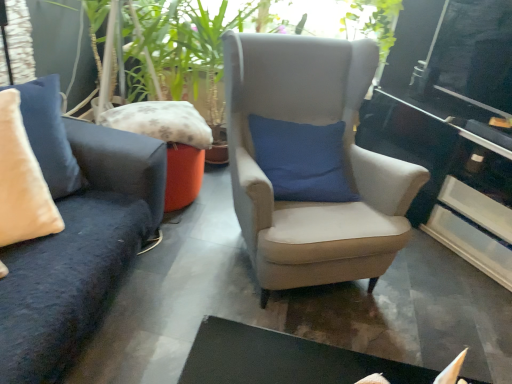
Question: Is fluffy fabric pillow at center, placed as the second pillow when sorted from front to back, situated inside suede beige armchair at center or outside?

Choices:
 (A) inside
 (B) outside

Answer: (B)

Question: Relative to suede beige armchair at center, is fluffy fabric pillow at center, positioned as the first pillow in back-to-front order, in front or behind?

Choices:
 (A) behind
 (B) front

Answer: (A)

Question: Based on their relative distances, which object is nearer to the fluffy fabric pillow at center, placed as the second pillow when sorted from front to back?

Choices:
 (A) beige velvet pillow at left, the 1th pillow from the front
 (B) suede beige armchair at center
 (C) glossy black table at right

Answer: (A)

Question: Which is farther from the glossy black table at right?

Choices:
 (A) beige velvet pillow at left, the 1th pillow from the front
 (B) suede beige armchair at center
 (C) fluffy fabric pillow at center, positioned as the first pillow in back-to-front order

Answer: (A)